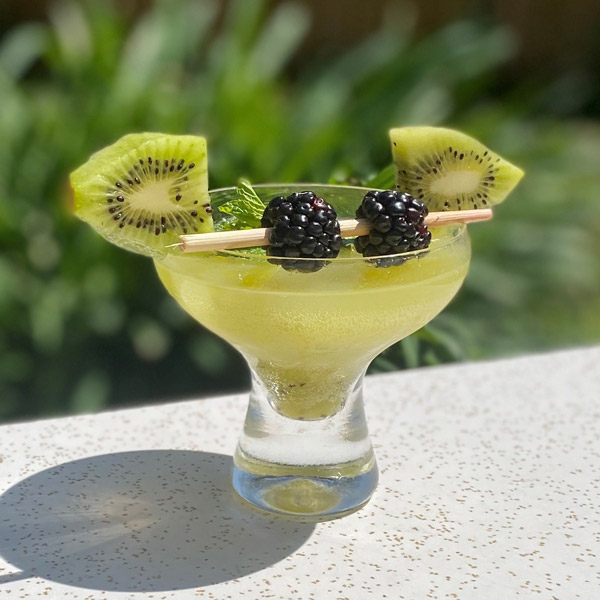
Locate an element on the screen. This screenshot has width=600, height=600. white tabletop with gold flecks is located at coordinates (462, 445).